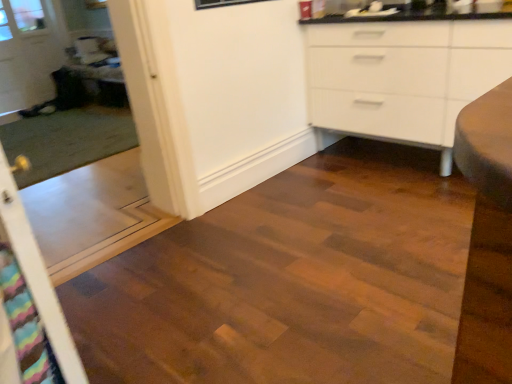
Question: Is transparent glass door at upper left taller than transparent plastic screen door at left, which appears as the 1th screen door when viewed from the back?

Choices:
 (A) yes
 (B) no

Answer: (A)

Question: Can you confirm if transparent glass door at upper left is positioned to the left of transparent plastic screen door at left, the 2th screen door from the front?

Choices:
 (A) no
 (B) yes

Answer: (B)

Question: Considering the relative sizes of transparent glass door at upper left and transparent plastic screen door at left, the 2th screen door from the front, in the image provided, is transparent glass door at upper left thinner than transparent plastic screen door at left, the 2th screen door from the front,?

Choices:
 (A) no
 (B) yes

Answer: (B)

Question: From the image's perspective, is transparent glass door at upper left located beneath transparent plastic screen door at left, which appears as the 1th screen door when viewed from the back?

Choices:
 (A) yes
 (B) no

Answer: (B)

Question: Is transparent glass door at upper left positioned beyond the bounds of transparent plastic screen door at left, the 2th screen door from the front?

Choices:
 (A) yes
 (B) no

Answer: (A)

Question: From a real-world perspective, relative to wooden table at left, is multicolored fabric screen door at left, acting as the 2th screen door starting from the back, vertically above or below?

Choices:
 (A) below
 (B) above

Answer: (B)

Question: In terms of size, does multicolored fabric screen door at left, acting as the 2th screen door starting from the back, appear bigger or smaller than wooden table at left?

Choices:
 (A) big
 (B) small

Answer: (B)

Question: From the image's perspective, is multicolored fabric screen door at left, acting as the 2th screen door starting from the back, above or below wooden table at left?

Choices:
 (A) below
 (B) above

Answer: (A)

Question: Considering the positions of point (14, 231) and point (113, 72), is point (14, 231) closer or farther from the camera than point (113, 72)?

Choices:
 (A) closer
 (B) farther

Answer: (A)

Question: Based on their sizes in the image, would you say multicolored fabric screen door at left, acting as the 2th screen door starting from the back, is bigger or smaller than transparent glass door at upper left?

Choices:
 (A) small
 (B) big

Answer: (A)

Question: Visually, is multicolored fabric screen door at left, which is the first screen door from front to back, positioned to the left or to the right of transparent glass door at upper left?

Choices:
 (A) right
 (B) left

Answer: (A)

Question: Is point (55, 334) closer or farther from the camera than point (10, 4)?

Choices:
 (A) farther
 (B) closer

Answer: (B)

Question: In terms of width, does multicolored fabric screen door at left, which is the first screen door from front to back, look wider or thinner when compared to transparent glass door at upper left?

Choices:
 (A) thin
 (B) wide

Answer: (B)

Question: From their relative heights in the image, would you say transparent glass door at upper left is taller or shorter than multicolored fabric screen door at left, which is the first screen door from front to back?

Choices:
 (A) short
 (B) tall

Answer: (B)

Question: Based on their positions, is transparent glass door at upper left located to the left or right of multicolored fabric screen door at left, acting as the 2th screen door starting from the back?

Choices:
 (A) right
 (B) left

Answer: (B)